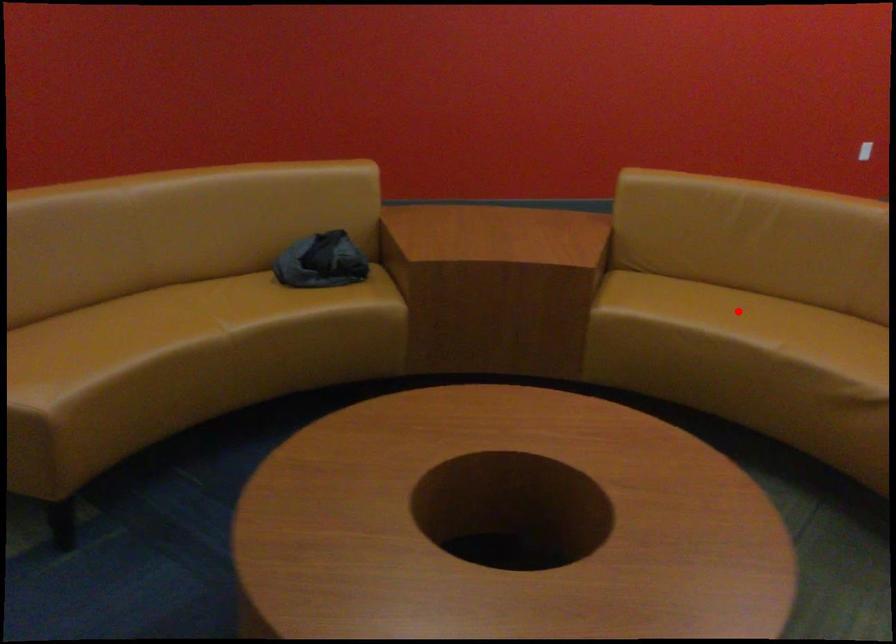
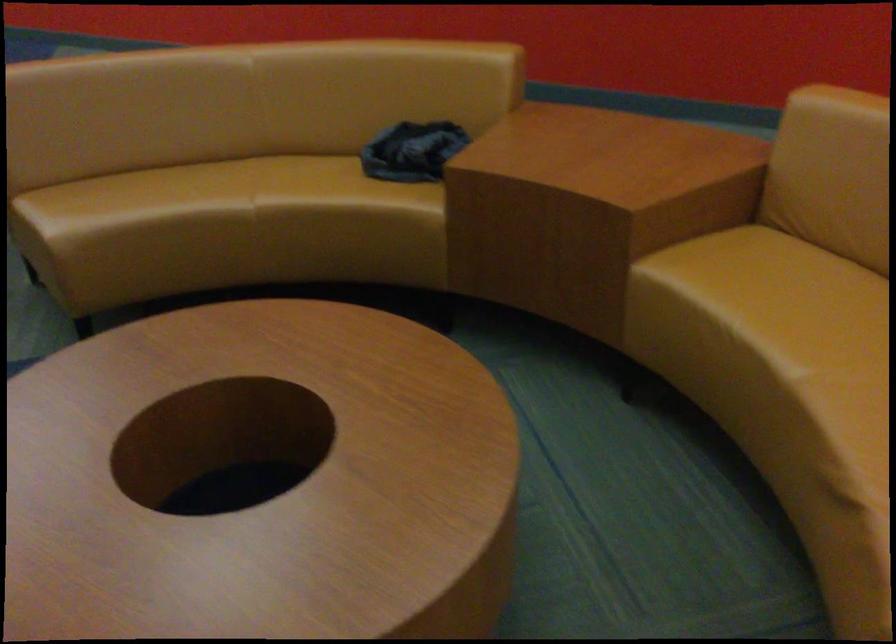
Where in the second image is the point corresponding to the highlighted location from the first image?

(814, 308)